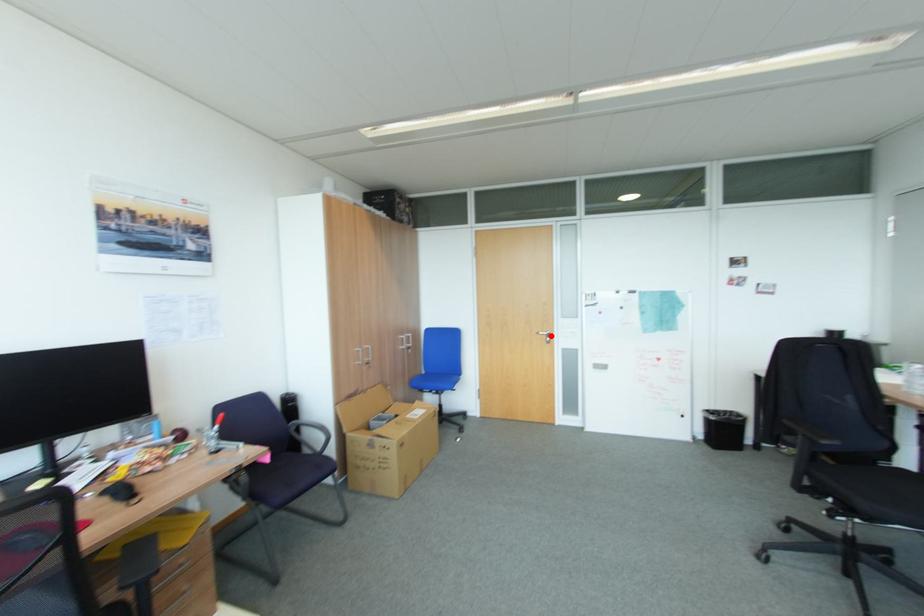
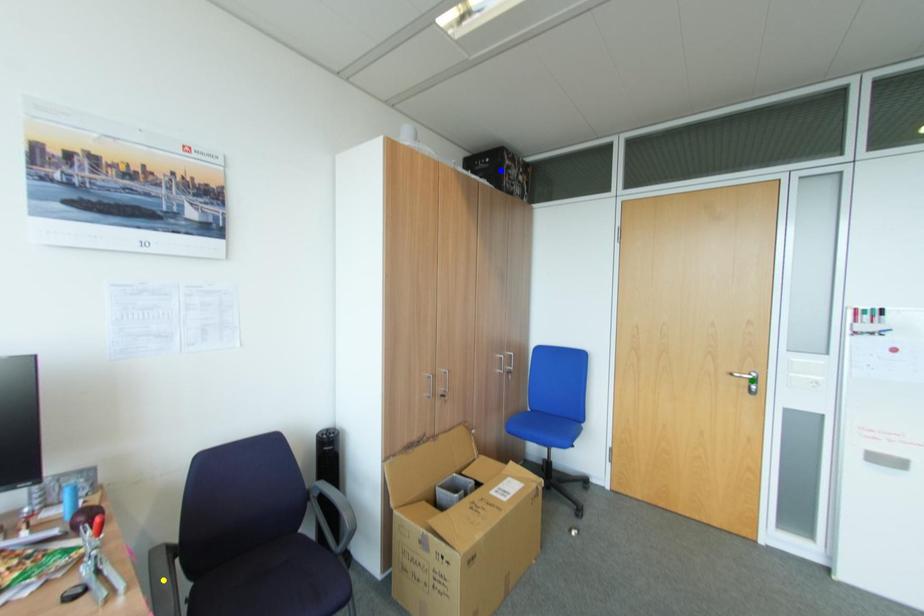
Question: I am providing you with two images of the same scene from different viewpoints. A red point is marked on the first image. You are given multiple points on the second image. Which mark in image 2 goes with the point in image 1?

Choices:
 (A) blue point
 (B) green point
 (C) yellow point

Answer: (B)